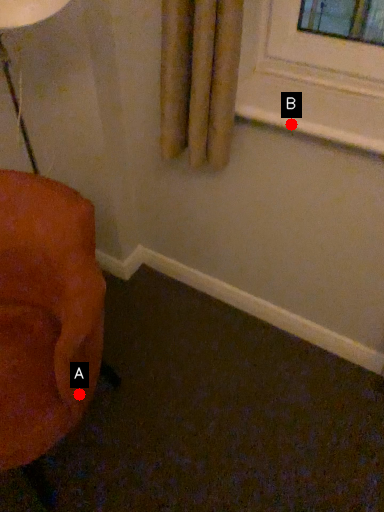
Question: Two points are circled on the image, labeled by A and B beside each circle. Which point is closer to the camera?

Choices:
 (A) A is closer
 (B) B is closer

Answer: (A)